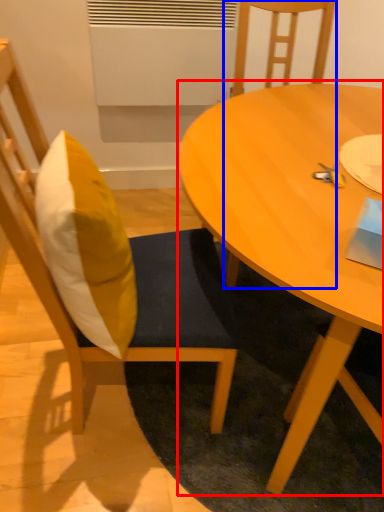
Question: Which object is further to the camera taking this photo, coffee table (highlighted by a red box) or chair (highlighted by a blue box)?

Choices:
 (A) coffee table
 (B) chair

Answer: (B)